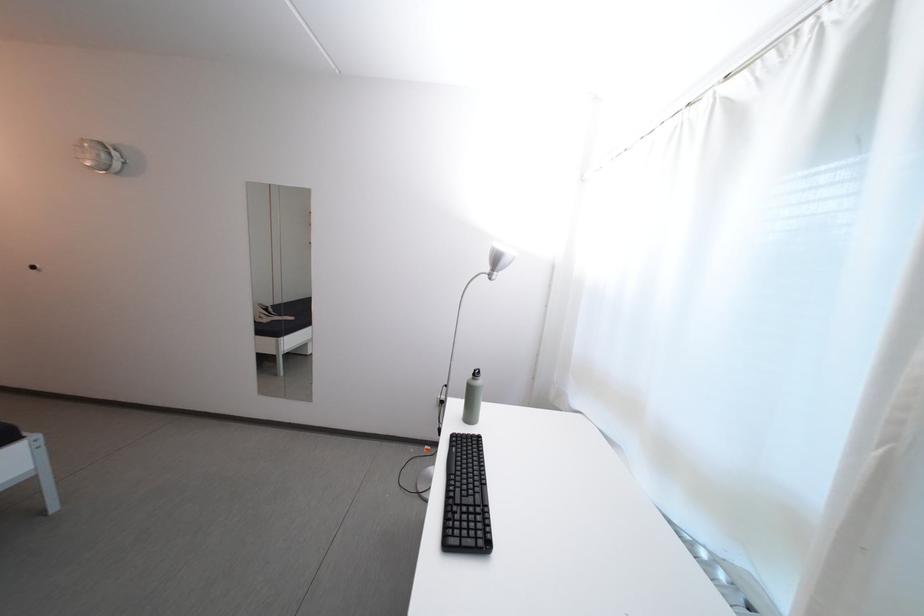
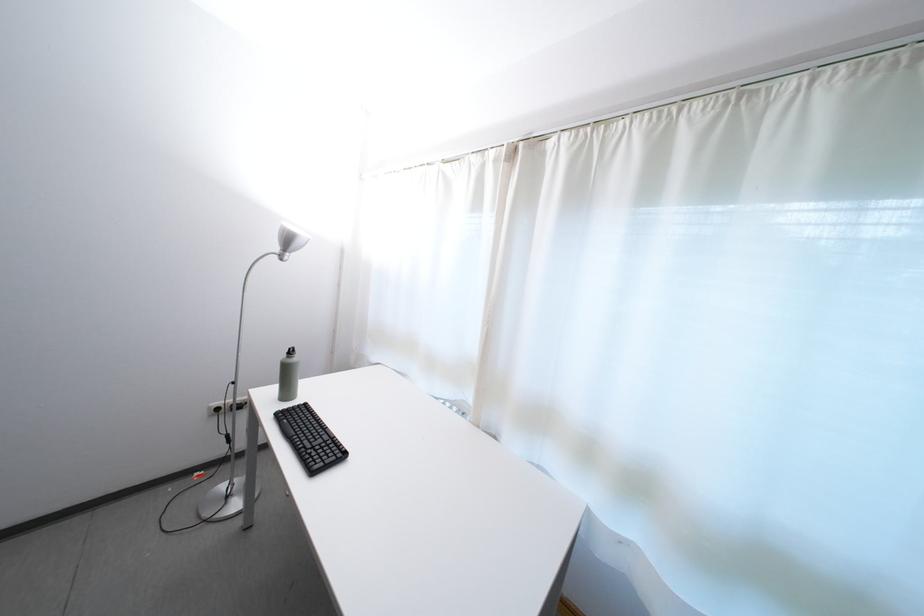
Locate, in the second image, the point that corresponds to (x=480, y=506) in the first image.

(330, 447)